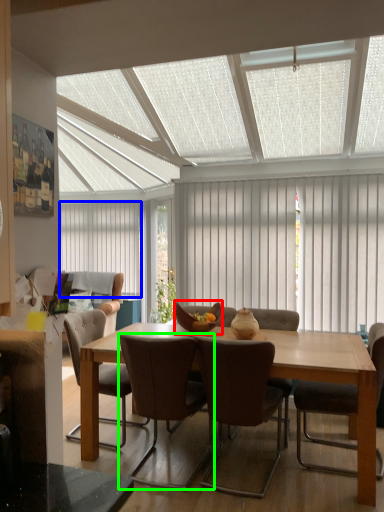
Question: Which is farther away from bowl (highlighted by a red box)? curtain (highlighted by a blue box) or chair (highlighted by a green box)?

Choices:
 (A) curtain
 (B) chair

Answer: (A)